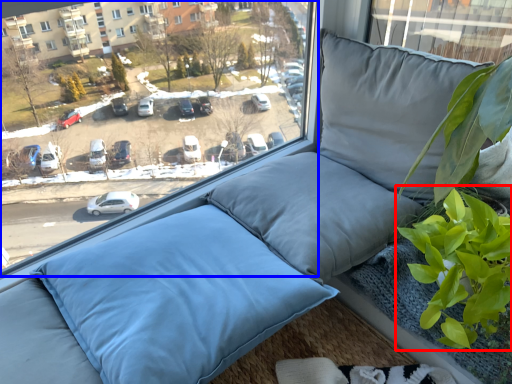
Question: Which point is further to the camera, vegetation (highlighted by a red box) or window (highlighted by a blue box)?

Choices:
 (A) vegetation
 (B) window

Answer: (A)